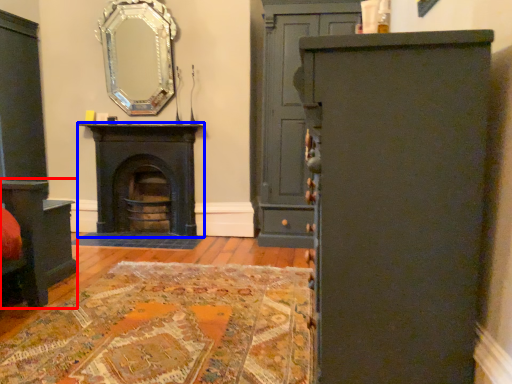
Question: Which of the following is the closest to the observer, vanity (highlighted by a red box) or fireplace (highlighted by a blue box)?

Choices:
 (A) vanity
 (B) fireplace

Answer: (A)